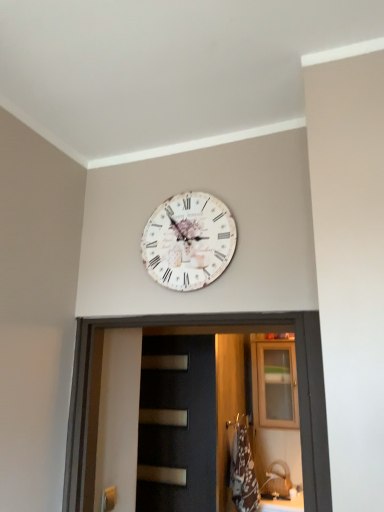
Question: From a real-world perspective, is white vintage clock at upper center positioned under brushed metal door handle at lower left based on gravity?

Choices:
 (A) no
 (B) yes

Answer: (A)

Question: Is white vintage clock at upper center bigger than brushed metal door handle at lower left?

Choices:
 (A) yes
 (B) no

Answer: (A)

Question: Can you confirm if white vintage clock at upper center is wider than brushed metal door handle at lower left?

Choices:
 (A) no
 (B) yes

Answer: (B)

Question: Is brushed metal door handle at lower left completely or partially inside white vintage clock at upper center?

Choices:
 (A) yes
 (B) no

Answer: (B)

Question: Can you confirm if white vintage clock at upper center is taller than brushed metal door handle at lower left?

Choices:
 (A) yes
 (B) no

Answer: (A)

Question: From a real-world perspective, is white vintage clock at upper center located higher than brushed metal door handle at lower left?

Choices:
 (A) yes
 (B) no

Answer: (A)

Question: Is wooden cabinet at upper center positioned in front of white vintage clock at upper center?

Choices:
 (A) yes
 (B) no

Answer: (B)

Question: From a real-world perspective, is wooden cabinet at upper center located higher than white vintage clock at upper center?

Choices:
 (A) yes
 (B) no

Answer: (B)

Question: Is wooden cabinet at upper center shorter than white vintage clock at upper center?

Choices:
 (A) yes
 (B) no

Answer: (B)

Question: Can you confirm if wooden cabinet at upper center is bigger than white vintage clock at upper center?

Choices:
 (A) no
 (B) yes

Answer: (B)

Question: Considering the relative positions of wooden cabinet at upper center and white vintage clock at upper center in the image provided, is wooden cabinet at upper center to the right of white vintage clock at upper center from the viewer's perspective?

Choices:
 (A) yes
 (B) no

Answer: (A)

Question: Does wooden cabinet at upper center have a smaller size compared to white vintage clock at upper center?

Choices:
 (A) yes
 (B) no

Answer: (B)

Question: From a real-world perspective, is black matte door at center under white vintage clock at upper center?

Choices:
 (A) yes
 (B) no

Answer: (A)